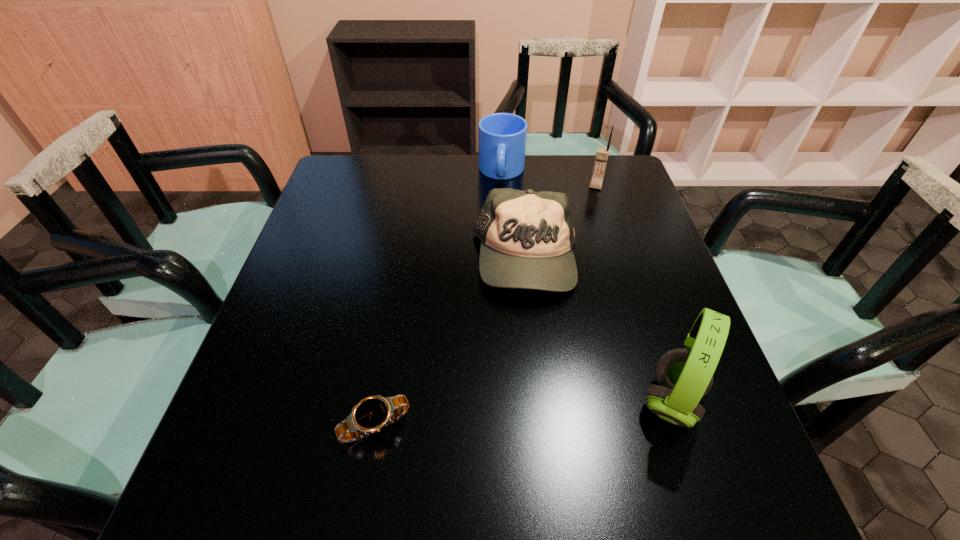
Where is `vacant region between the headset and the mug`? This screenshot has width=960, height=540. vacant region between the headset and the mug is located at coordinates (587, 287).

This screenshot has height=540, width=960. Find the location of `object that stands as the closest to the leftmost object`. object that stands as the closest to the leftmost object is located at coordinates (527, 237).

At what (x,y) coordinates should I click in order to perform the action: click on object that is the fourth closest one to the watch. Please return your answer as a coordinate pair (x, y). The height and width of the screenshot is (540, 960). Looking at the image, I should click on (602, 154).

This screenshot has width=960, height=540. What are the coordinates of `vacant space that satisfies the following two spatial constraints: 1. on the back side of the shortest object; 2. on the right side of the mug` in the screenshot? It's located at (420, 172).

You are a GUI agent. You are given a task and a screenshot of the screen. Output one action in this format:
    pyautogui.click(x=<x>, y=<y>)
    Task: Click on the free region that satisfies the following two spatial constraints: 1. on the back side of the third nearest object; 2. on the left side of the cellular telephone
    
    Given the screenshot: What is the action you would take?
    pyautogui.click(x=518, y=186)

This screenshot has height=540, width=960. Find the location of `vacant position in the image that satisfies the following two spatial constraints: 1. on the front side of the mug; 2. on the left side of the baseball cap`. vacant position in the image that satisfies the following two spatial constraints: 1. on the front side of the mug; 2. on the left side of the baseball cap is located at coordinates (507, 260).

This screenshot has height=540, width=960. What are the coordinates of `vacant space that satisfies the following two spatial constraints: 1. on the back side of the watch; 2. on the right side of the third nearest object` in the screenshot? It's located at tap(404, 260).